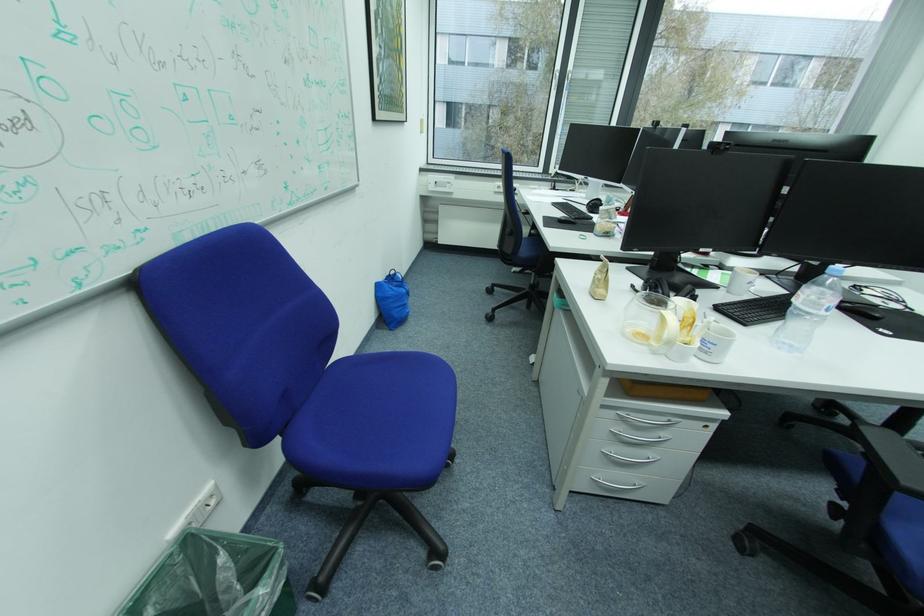
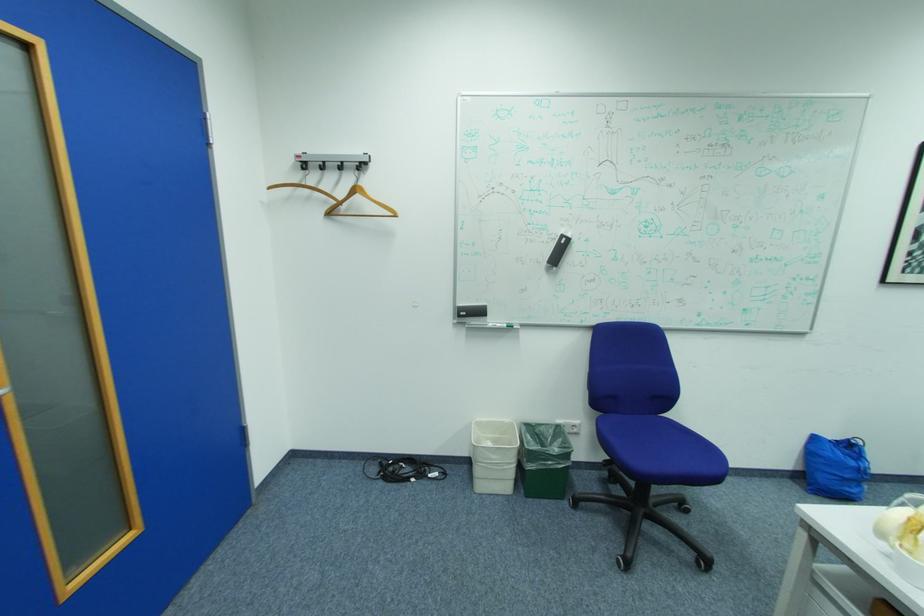
In the second image, find the point that corresponds to point (400, 293) in the first image.

(839, 456)